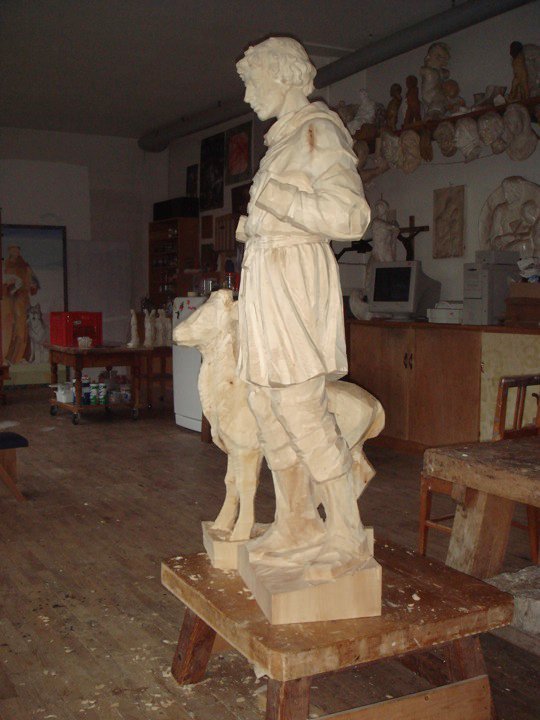
Where is `statue of dog or lamb`? statue of dog or lamb is located at coordinates (212, 327).